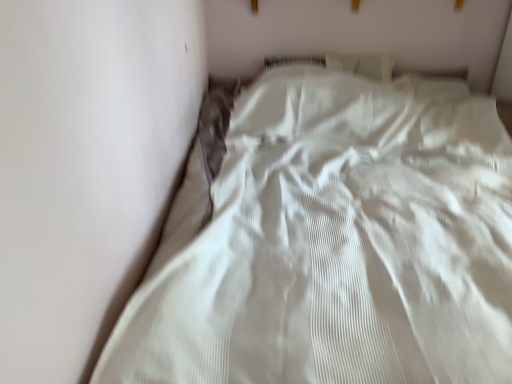
Find the location of `white textured bed at center`. white textured bed at center is located at coordinates (334, 243).

What do you see at coordinates (334, 243) in the screenshot?
I see `white textured bed at center` at bounding box center [334, 243].

This screenshot has width=512, height=384. I want to click on white textured bed at center, so click(334, 243).